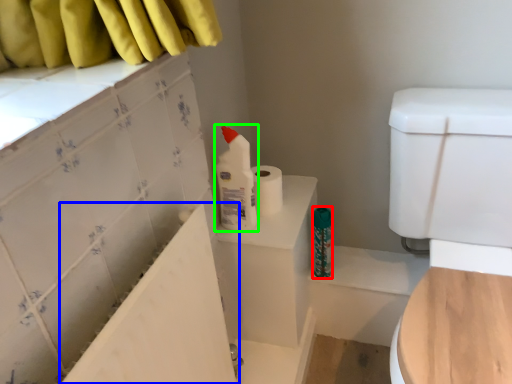
Question: Estimate the real-world distances between objects in this image. Which object is farther from toiletry (highlighted by a red box), bath (highlighted by a blue box) or cleaning product (highlighted by a green box)?

Choices:
 (A) bath
 (B) cleaning product

Answer: (A)